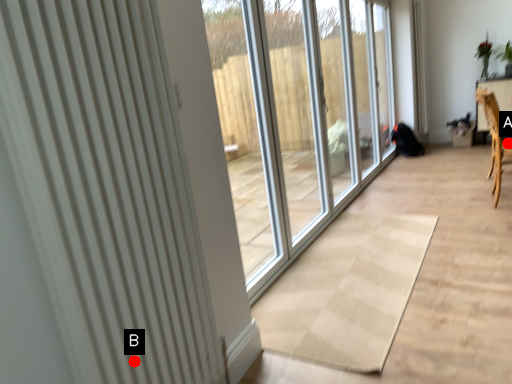
Question: Two points are circled on the image, labeled by A and B beside each circle. Which point is farther from the camera taking this photo?

Choices:
 (A) A is further
 (B) B is further

Answer: (A)